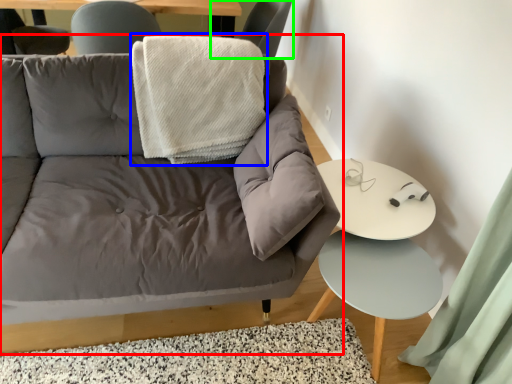
Question: Considering the real-world distances, which object is closest to studio couch (highlighted by a red box)? blanket (highlighted by a blue box) or chair (highlighted by a green box).

Choices:
 (A) blanket
 (B) chair

Answer: (A)